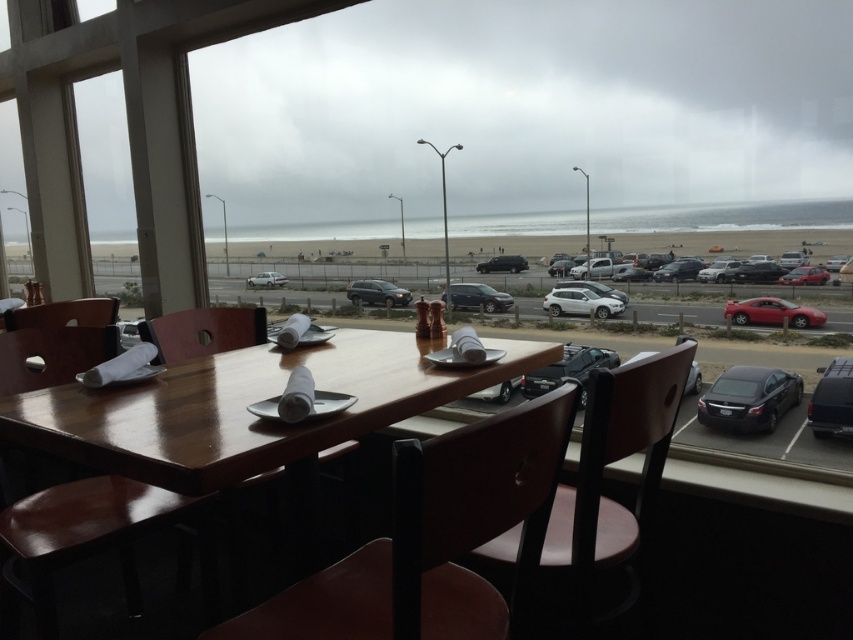
Who is more distant from viewer, (611, 349) or (599, 288)?

Point (611, 349)

The image size is (853, 640). What do you see at coordinates (567, 369) in the screenshot? I see `shiny black car at center` at bounding box center [567, 369].

Where is `shiny black car at center`? shiny black car at center is located at coordinates (567, 369).

Is black matte van at lower right above white matte car at center?

Incorrect, black matte van at lower right is not positioned above white matte car at center.

Is black matte van at lower right to the right of white matte car at center from the viewer's perspective?

Indeed, black matte van at lower right is positioned on the right side of white matte car at center.

Where is `black matte van at lower right`? This screenshot has width=853, height=640. black matte van at lower right is located at coordinates (833, 401).

Is brown wood chair at left positioned in front of black matte van at lower right?

Yes, it is in front of black matte van at lower right.

Measure the distance between brown wood chair at left and camera.

1.56 meters

Does point (91, 529) come in front of point (817, 435)?

Yes, it is in front of point (817, 435).

Where is `brown wood chair at left`? brown wood chair at left is located at coordinates (76, 540).